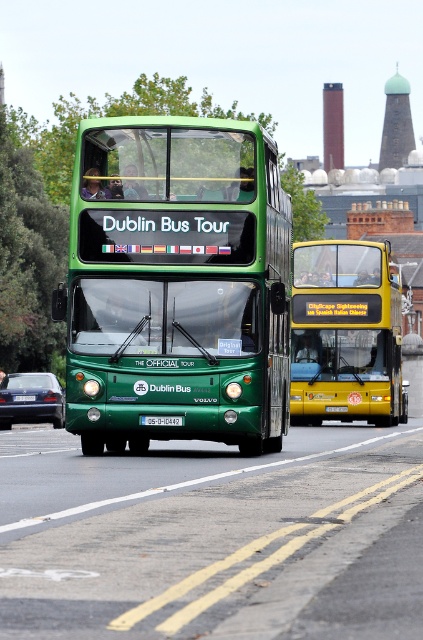
Question: Is green matte double-decker bus at center below yellow metallic bus at center?

Choices:
 (A) yes
 (B) no

Answer: (B)

Question: Does green matte double-decker bus at center have a larger size compared to yellow metallic bus at center?

Choices:
 (A) yes
 (B) no

Answer: (A)

Question: Which of the following is the farthest from the observer?

Choices:
 (A) (382, 408)
 (B) (172, 416)
 (C) (123, 364)

Answer: (A)

Question: Which of the following is the closest to the observer?

Choices:
 (A) red plastic license plate at center
 (B) yellow metallic bus at center

Answer: (A)

Question: Does green matte double-decker bus at center lie behind yellow metallic bus at center?

Choices:
 (A) yes
 (B) no

Answer: (B)

Question: Which of the following is the closest to the observer?

Choices:
 (A) (304, 353)
 (B) (140, 417)
 (C) (32, 372)
 (D) (288, 365)

Answer: (B)